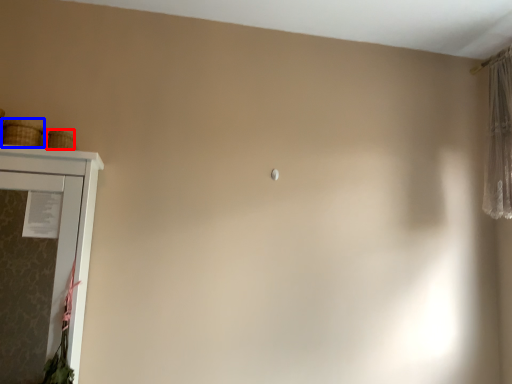
Question: Which of the following is the farthest to the observer, basket (highlighted by a red box) or basket (highlighted by a blue box)?

Choices:
 (A) basket
 (B) basket

Answer: (A)